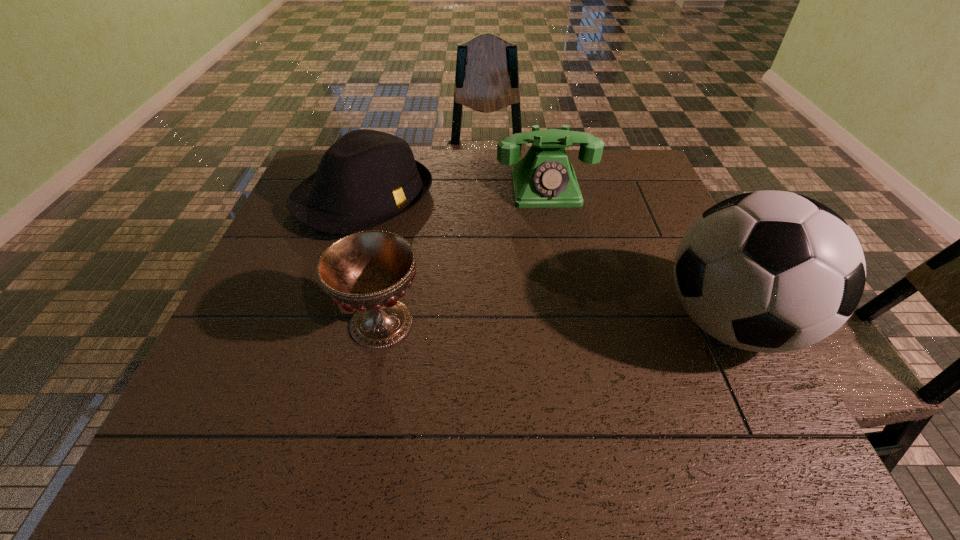
Where is `free location that satisfies the following two spatial constraints: 1. on the back side of the second object from right to left; 2. on the left side of the fedora`? The width and height of the screenshot is (960, 540). free location that satisfies the following two spatial constraints: 1. on the back side of the second object from right to left; 2. on the left side of the fedora is located at coordinates (368, 188).